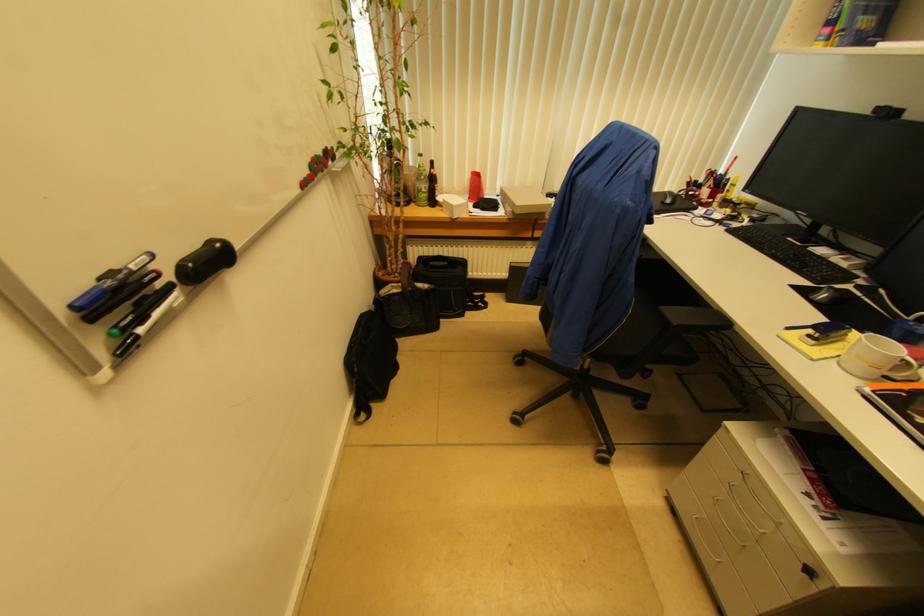
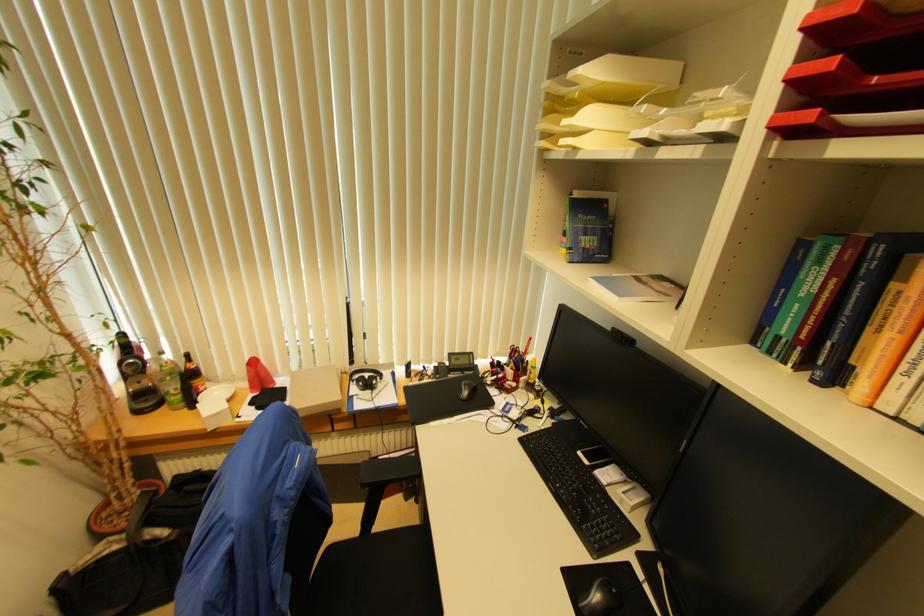
Question: What movement of the cameraman would produce the second image?

Choices:
 (A) Left
 (B) Right
 (C) Forward
 (D) Backward

Answer: (B)